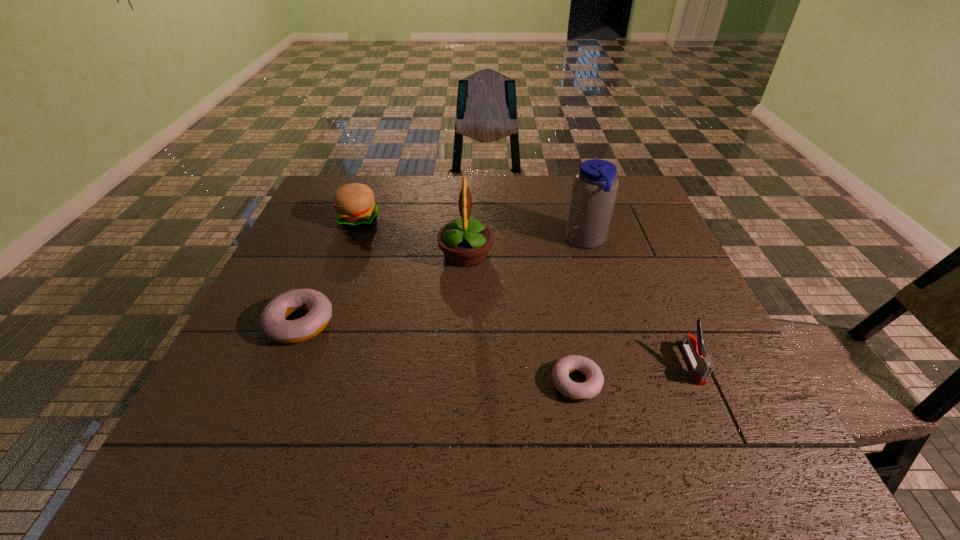
The width and height of the screenshot is (960, 540). Identify the location of the fifth tallest object. (272, 320).

Image resolution: width=960 pixels, height=540 pixels. I want to click on the left doughnut, so click(272, 320).

Identify the location of the nearer doughnut. (563, 367).

Locate an element on the screen. the right doughnut is located at coordinates (563, 367).

This screenshot has width=960, height=540. What are the coordinates of `sunflower` in the screenshot? It's located at (465, 242).

The height and width of the screenshot is (540, 960). In order to click on water bottle in this screenshot , I will do click(x=595, y=186).

This screenshot has width=960, height=540. In order to click on hamburger in this screenshot , I will do `click(355, 208)`.

Locate an element on the screen. The width and height of the screenshot is (960, 540). stapler is located at coordinates (702, 367).

Where is `vacant space located on the back of the fifth tallest object`? Image resolution: width=960 pixels, height=540 pixels. vacant space located on the back of the fifth tallest object is located at coordinates (317, 283).

The height and width of the screenshot is (540, 960). I want to click on vacant space located on the left of the shorter doughnut, so click(x=373, y=383).